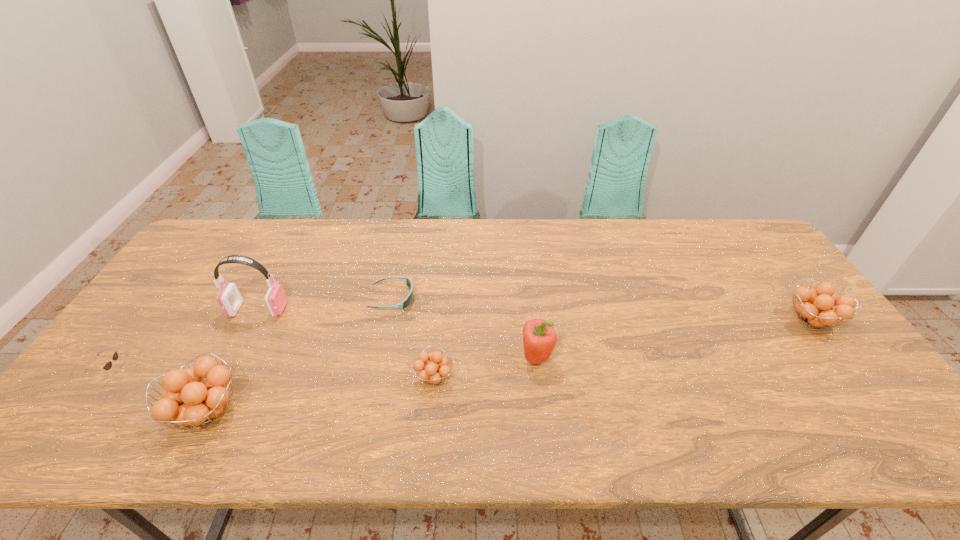
You are a GUI agent. You are given a task and a screenshot of the screen. Output one action in this format:
    pyautogui.click(x=<x>, y=<y>)
    Task: Click on the object positioned at the right edge
    
    Given the screenshot: What is the action you would take?
    [x=815, y=307]

Locate an element on the screen. This screenshot has height=540, width=960. object that is at the near left corner is located at coordinates (108, 365).

Find the location of a particular element. The width and height of the screenshot is (960, 540). blank space at the far edge of the desktop is located at coordinates (643, 237).

At what (x,y) coordinates should I click in order to perform the action: click on free space at the near edge. Please return your answer as a coordinate pair (x, y). Looking at the image, I should click on (262, 381).

Image resolution: width=960 pixels, height=540 pixels. I want to click on vacant space at the left edge of the desktop, so click(180, 268).

This screenshot has width=960, height=540. I want to click on blank space at the near left corner, so click(x=86, y=392).

In the image, there is a desktop. At what (x,y) coordinates should I click in order to perform the action: click on free space at the far right corner. Please return your answer as a coordinate pair (x, y). Image resolution: width=960 pixels, height=540 pixels. Looking at the image, I should click on (761, 243).

This screenshot has height=540, width=960. Find the location of `blank region between the fourth shortest object and the earphone`. blank region between the fourth shortest object and the earphone is located at coordinates (535, 315).

Where is `vacant region between the sixth tallest object and the leftmost orange fruit`? This screenshot has width=960, height=540. vacant region between the sixth tallest object and the leftmost orange fruit is located at coordinates (159, 392).

Identify the location of unoccupied area between the tallest object and the shortest object. The width and height of the screenshot is (960, 540). (325, 304).